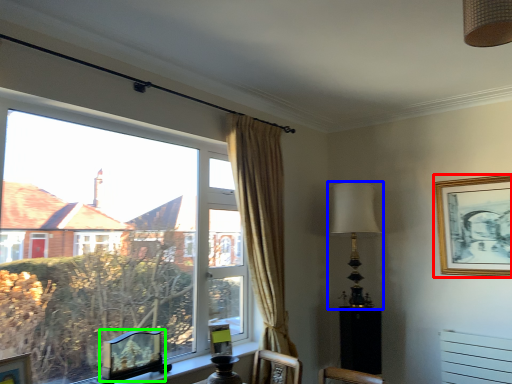
Question: Which is nearer to the picture frame (highlighted by a red box)? table lamp (highlighted by a blue box) or picture frame (highlighted by a green box).

Choices:
 (A) table lamp
 (B) picture frame

Answer: (A)